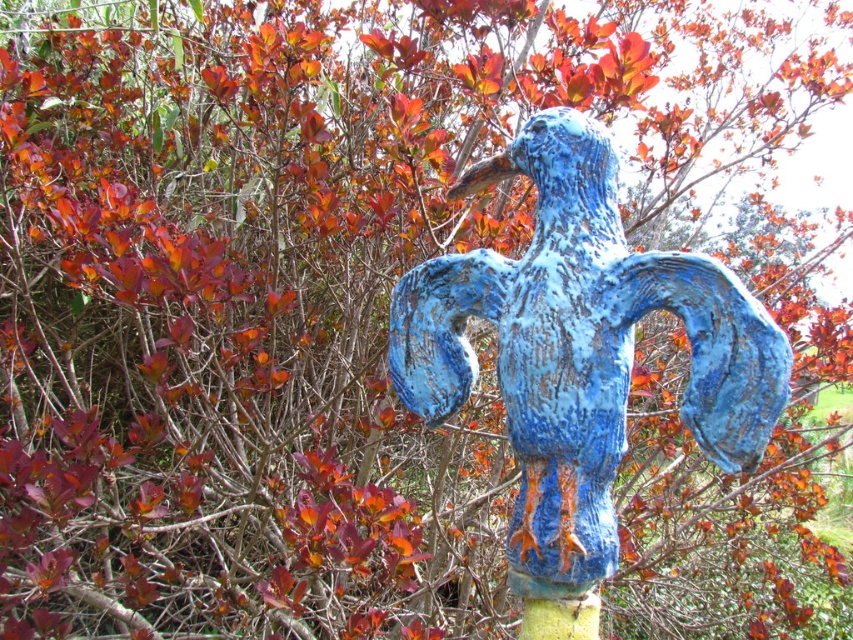
You are a photographer standing at a distance. You want to capture the blue chipped paint bird at center in your shot without any background elements. Given that the minimum focusing distance of your camera is 40 inches, will you be able to take the photo clearly?

The blue chipped paint bird at center is 39.33 inches away from the camera. Since the minimum focusing distance is 40 inches, the camera cannot focus clearly at distances closer than 40 inches. Therefore, the photo may appear blurry or out of focus.

You are standing at the origin point of the coordinate system in the image. The blue chipped paint bird at center is located at point (x=579, y=349). You want to move towards the blue chipped paint bird at center. Which direction should you move in the image?

To move towards the blue chipped paint bird at center located at point (x=579, y=349) from the origin, you should move northeast in the image, as the coordinates are both greater than 0.5, indicating the upper right quadrant.